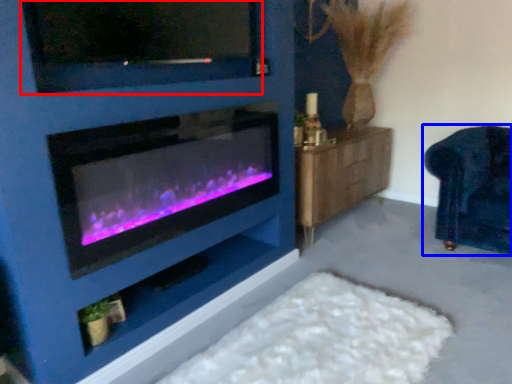
Question: Which of the following is the closest to the observer, tv show (highlighted by a red box) or furniture (highlighted by a blue box)?

Choices:
 (A) tv show
 (B) furniture

Answer: (A)